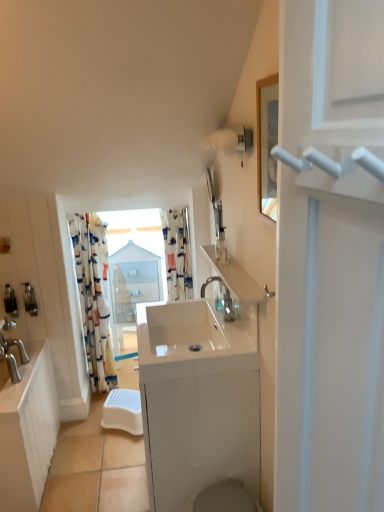
What is the approximate width of white glossy sink at center, the 2th counter top positioned from the left?

white glossy sink at center, the 2th counter top positioned from the left, is 17.88 inches wide.

Describe the element at coordinates (225, 498) in the screenshot. I see `white glossy toilet bowl at lower center` at that location.

The image size is (384, 512). In order to click on floral fabric curtain at center, positioned as the first curtain in left-to-right order in this screenshot , I will do `click(93, 298)`.

Describe the element at coordinates (177, 253) in the screenshot. This screenshot has height=512, width=384. I see `printed fabric curtain at center, the first curtain when ordered from right to left` at that location.

Where is `clear plastic bottle at upper center, which appears as the 3th toiletry when ordered from the bottom`? clear plastic bottle at upper center, which appears as the 3th toiletry when ordered from the bottom is located at coordinates (221, 246).

What are the coordinates of `white glossy sink at center, positioned as the 1th counter top in right-to-left order` in the screenshot? It's located at (198, 401).

Is white glossy sink at center, the 2th counter top positioned from the left, to the left or to the right of white glossy sink at center in the image?

In the image, white glossy sink at center, the 2th counter top positioned from the left, appears on the right side of white glossy sink at center.

From a real-world perspective, is white glossy sink at center, positioned as the 1th counter top in right-to-left order, positioned above or below white glossy sink at center?

white glossy sink at center, positioned as the 1th counter top in right-to-left order, is below white glossy sink at center.

Is white glossy sink at center, the 2th counter top positioned from the left, closer to the viewer compared to white glossy sink at center?

No, white glossy sink at center, the 2th counter top positioned from the left, is behind white glossy sink at center.

Consider the image. Is white glossy sink at center, the 2th counter top positioned from the left, with white glossy sink at center?

There is a gap between white glossy sink at center, the 2th counter top positioned from the left, and white glossy sink at center.

From the image's perspective, would you say metallic silver soap dispenser at left, the 1th toiletry positioned from the bottom, is positioned over white plastic step stool at center?

Correct, metallic silver soap dispenser at left, the 1th toiletry positioned from the bottom, appears higher than white plastic step stool at center in the image.

Between metallic silver soap dispenser at left, the second toiletry when ordered from front to back, and white plastic step stool at center, which one has less height?

white plastic step stool at center.

Does metallic silver soap dispenser at left, which is counted as the third toiletry, starting from the right, appear on the right side of white plastic step stool at center?

No, metallic silver soap dispenser at left, which is counted as the third toiletry, starting from the right, is not to the right of white plastic step stool at center.

Is there a large distance between metallic silver soap dispenser at left, the 1th toiletry in the left-to-right sequence, and white plastic step stool at center?

No, metallic silver soap dispenser at left, the 1th toiletry in the left-to-right sequence, is in close proximity to white plastic step stool at center.

From the image's perspective, is floral fabric curtain at center, arranged as the second curtain when viewed from the right, positioned above or below white glossy toilet bowl at lower center?

From the image's perspective, floral fabric curtain at center, arranged as the second curtain when viewed from the right, appears above white glossy toilet bowl at lower center.

Can we say floral fabric curtain at center, positioned as the first curtain in left-to-right order, lies outside white glossy toilet bowl at lower center?

Yes, floral fabric curtain at center, positioned as the first curtain in left-to-right order, is outside of white glossy toilet bowl at lower center.

Can you tell me how much floral fabric curtain at center, positioned as the first curtain in left-to-right order, and white glossy toilet bowl at lower center differ in facing direction?

89.4 degrees separate the facing orientations of floral fabric curtain at center, positioned as the first curtain in left-to-right order, and white glossy toilet bowl at lower center.

Between floral fabric curtain at center, arranged as the second curtain when viewed from the right, and white glossy toilet bowl at lower center, which one has smaller width?

floral fabric curtain at center, arranged as the second curtain when viewed from the right.

Which of these two, white glossy sink at center, the 2th counter top positioned from the left, or translucent plastic soap dispenser at left, which appears as the 3th toiletry when viewed from the front, stands taller?

white glossy sink at center, the 2th counter top positioned from the left, is taller.

From a real-world perspective, which is physically below, white glossy sink at center, positioned as the 1th counter top in right-to-left order, or translucent plastic soap dispenser at left, arranged as the 2th toiletry when viewed from the right?

In real-world perspective, white glossy sink at center, positioned as the 1th counter top in right-to-left order, is lower.

From the picture: Can you tell me how much white glossy sink at center, positioned as the 1th counter top in right-to-left order, and translucent plastic soap dispenser at left, the second toiletry positioned from the top, differ in facing direction?

The angular difference between white glossy sink at center, positioned as the 1th counter top in right-to-left order, and translucent plastic soap dispenser at left, the second toiletry positioned from the top, is 88.6 degrees.

From the picture: From a real-world perspective, is transparent glass window at center positioned under white glossy sink at center, the 2th counter top positioned from the left, based on gravity?

Actually, transparent glass window at center is physically above white glossy sink at center, the 2th counter top positioned from the left, in the real world.

Is transparent glass window at center beside white glossy sink at center, positioned as the 1th counter top in right-to-left order?

No, transparent glass window at center is not touching white glossy sink at center, positioned as the 1th counter top in right-to-left order.

Is transparent glass window at center shorter than white glossy sink at center, the 2th counter top positioned from the left?

In fact, transparent glass window at center may be taller than white glossy sink at center, the 2th counter top positioned from the left.

Is the depth of transparent glass window at center greater than that of white glossy sink at center, positioned as the 1th counter top in right-to-left order?

Yes, transparent glass window at center is further from the viewer.

In terms of size, does clear plastic bottle at upper center, which appears as the 3th toiletry when ordered from the bottom, appear bigger or smaller than metallic silver soap dispenser at left, the 2th toiletry positioned from the back?

Considering their sizes, clear plastic bottle at upper center, which appears as the 3th toiletry when ordered from the bottom, takes up more space than metallic silver soap dispenser at left, the 2th toiletry positioned from the back.

Is clear plastic bottle at upper center, acting as the third toiletry starting from the back, not close to metallic silver soap dispenser at left, which appears as the 3th toiletry when viewed from the top?

Yes, clear plastic bottle at upper center, acting as the third toiletry starting from the back, is far from metallic silver soap dispenser at left, which appears as the 3th toiletry when viewed from the top.

From a real-world perspective, is clear plastic bottle at upper center, which is counted as the first toiletry, starting from the top, above or below metallic silver soap dispenser at left, which appears as the 3th toiletry when viewed from the top?

In terms of real-world spatial position, clear plastic bottle at upper center, which is counted as the first toiletry, starting from the top, is above metallic silver soap dispenser at left, which appears as the 3th toiletry when viewed from the top.

In terms of height, does clear plastic bottle at upper center, acting as the third toiletry starting from the back, look taller or shorter compared to metallic silver soap dispenser at left, the 1th toiletry positioned from the bottom?

Clearly, clear plastic bottle at upper center, acting as the third toiletry starting from the back, is taller compared to metallic silver soap dispenser at left, the 1th toiletry positioned from the bottom.

From a real-world perspective, which is physically below, metallic silver soap dispenser at left, the 1th toiletry positioned from the bottom, or clear plastic bottle at upper center, marked as the third toiletry in a left-to-right arrangement?

From a 3D spatial view, metallic silver soap dispenser at left, the 1th toiletry positioned from the bottom, is below.

Is the depth of metallic silver soap dispenser at left, the 2th toiletry positioned from the back, greater than that of clear plastic bottle at upper center, marked as the third toiletry in a left-to-right arrangement?

Yes, metallic silver soap dispenser at left, the 2th toiletry positioned from the back, is behind clear plastic bottle at upper center, marked as the third toiletry in a left-to-right arrangement.

Where is `the 2nd toiletry to the right when counting from the metallic silver soap dispenser at left, the 1th toiletry positioned from the bottom`? This screenshot has width=384, height=512. the 2nd toiletry to the right when counting from the metallic silver soap dispenser at left, the 1th toiletry positioned from the bottom is located at coordinates (221, 246).

From the image's perspective, count 2nd counter tops downward from the white glossy sink at center and point to it. Please provide its 2D coordinates.

[(198, 401)]

You are a GUI agent. You are given a task and a screenshot of the screen. Output one action in this format:
    pyautogui.click(x=<x>, y=<y>)
    Task: Click on the step stool to the right of metallic silver soap dispenser at left, the 2th toiletry positioned from the back
    The image size is (384, 512).
    Given the screenshot: What is the action you would take?
    pyautogui.click(x=123, y=411)

Based on their spatial positions, is transparent glass window at center or metallic silver soap dispenser at left, the 1th toiletry positioned from the bottom, further from white glossy sink at center?

metallic silver soap dispenser at left, the 1th toiletry positioned from the bottom, is positioned further to the anchor white glossy sink at center.

Consider the image. Which object lies further to the anchor point white glossy toilet bowl at lower center, white glossy sink at center, the 2th counter top positioned from the left, or metallic silver soap dispenser at left, the second toiletry when ordered from front to back?

Among the two, metallic silver soap dispenser at left, the second toiletry when ordered from front to back, is located further to white glossy toilet bowl at lower center.

When comparing their distances from white glossy sink at center, does transparent glass window at center or floral fabric curtain at center, positioned as the first curtain in left-to-right order, seem further?

The object further to white glossy sink at center is floral fabric curtain at center, positioned as the first curtain in left-to-right order.

Which object lies further to the anchor point white glossy sink at center, positioned as the 1th counter top in right-to-left order, white glossy sink at center or clear plastic bottle at upper center, which appears as the 3th toiletry when ordered from the bottom?

clear plastic bottle at upper center, which appears as the 3th toiletry when ordered from the bottom, is further to white glossy sink at center, positioned as the 1th counter top in right-to-left order.

Looking at the image, which one is located further to translucent plastic soap dispenser at left, which is the 2th toiletry in left-to-right order, white glossy sink at center, the 2th counter top positioned from the left, or white plastic step stool at center?

white glossy sink at center, the 2th counter top positioned from the left, lies further to translucent plastic soap dispenser at left, which is the 2th toiletry in left-to-right order, than the other object.

From the image, which object appears to be nearer to printed fabric curtain at center, the first curtain when ordered from right to left, white glossy toilet bowl at lower center or satin nickel faucet at center?

satin nickel faucet at center is positioned closer to the anchor printed fabric curtain at center, the first curtain when ordered from right to left.

Considering their positions, is white glossy toilet bowl at lower center positioned further to metallic silver soap dispenser at left, the second toiletry when ordered from front to back, than satin nickel faucet at center?

Among the two, white glossy toilet bowl at lower center is located further to metallic silver soap dispenser at left, the second toiletry when ordered from front to back.

Considering their positions, is metallic silver soap dispenser at left, which appears as the 3th toiletry when viewed from the top, positioned further to white glossy toilet bowl at lower center than clear plastic bottle at upper center, the first toiletry viewed from the right?

metallic silver soap dispenser at left, which appears as the 3th toiletry when viewed from the top.

Locate an element on the screen. toiletry located between white glossy sink at left, which ranks as the second counter top in right-to-left order, and clear plastic bottle at upper center, the first toiletry viewed from the right, in the left-right direction is located at coordinates (30, 298).

What are the coordinates of `toiletry between translucent plastic soap dispenser at left, arranged as the 2th toiletry when viewed from the right, and white plastic step stool at center, in the vertical direction` in the screenshot? It's located at (10, 301).

Locate an element on the screen. toiletry situated between metallic silver soap dispenser at left, the 2th toiletry positioned from the back, and clear plastic bottle at upper center, the 1th toiletry positioned from the front, from left to right is located at coordinates (30, 298).

Locate an element on the screen. counter top situated between translucent plastic soap dispenser at left, the second toiletry positioned from the top, and clear plastic bottle at upper center, which appears as the 3th toiletry when ordered from the bottom, from left to right is located at coordinates (198, 401).